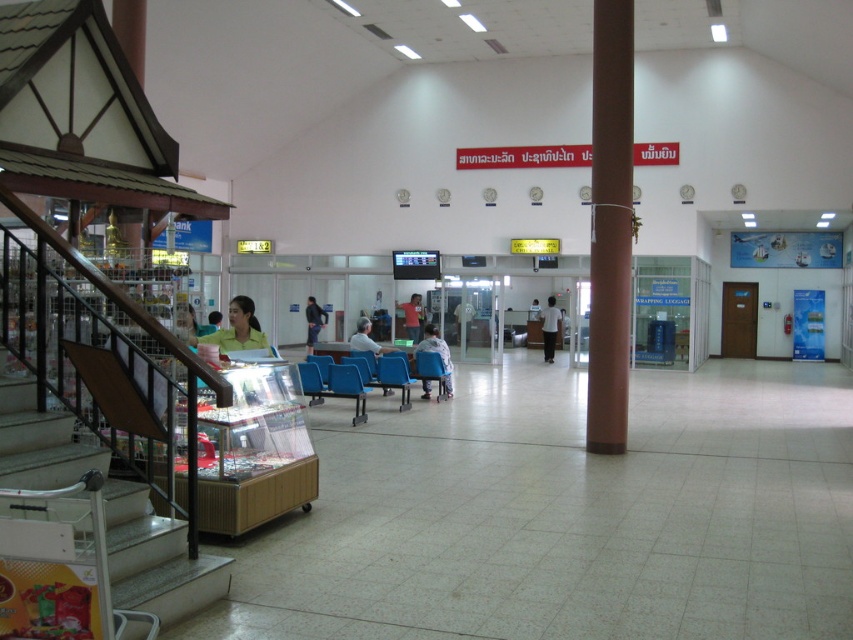
You are a delivery robot with a 2.5 meter long package. You need to move from the entrance to the service counter located near the brown column at center. There is a light brown leather jacket at center and dark blue jeans at center in your path. Can you navigate around them without dropping the package?

The distance between the light brown leather jacket at center and dark blue jeans at center is 2.73 meters. Since the package is 2.5 meters long, the robot can navigate around them as there is enough space between the two objects to maneuver safely.